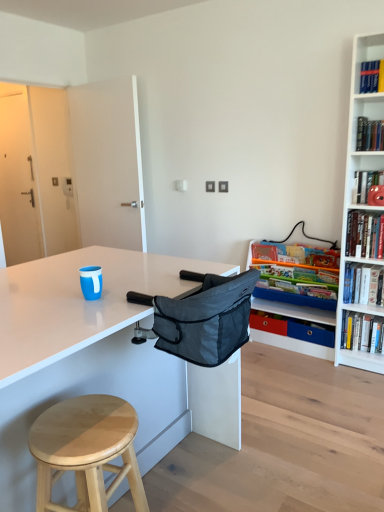
In order to face red plastic drawer at lower right, should I rotate leftwards or rightwards?

Turn right approximately 10.240 degrees to face it.

What do you see at coordinates (295, 311) in the screenshot?
I see `matte plastic shelf at right` at bounding box center [295, 311].

What do you see at coordinates (362, 332) in the screenshot? I see `hardcover book at upper right, marked as the fourth book in a top-to-bottom arrangement` at bounding box center [362, 332].

In order to face hardcover book at right, placed as the third book when sorted from bottom to top, should I rotate leftwards or rightwards?

Turn right by 13.514 degrees to look at hardcover book at right, placed as the third book when sorted from bottom to top.

Find the location of `light wood stool at lower left`. light wood stool at lower left is located at coordinates (86, 450).

Locate an element on the screen. The image size is (384, 512). red plastic drawer at lower right is located at coordinates (268, 322).

Considering the relative sizes of hardcover book at upper right, arranged as the fourth book when ordered from the bottom, and red plastic drawer at lower right in the image provided, is hardcover book at upper right, arranged as the fourth book when ordered from the bottom, taller than red plastic drawer at lower right?

Indeed, hardcover book at upper right, arranged as the fourth book when ordered from the bottom, has a greater height compared to red plastic drawer at lower right.

Looking at this image, who is bigger, hardcover book at upper right, the first book viewed from the top, or red plastic drawer at lower right?

With larger size is hardcover book at upper right, the first book viewed from the top.

Is hardcover book at upper right, arranged as the fourth book when ordered from the bottom, located outside red plastic drawer at lower right?

Yes, hardcover book at upper right, arranged as the fourth book when ordered from the bottom, is outside of red plastic drawer at lower right.

Which object is closer to the camera, hardcover book at upper right, the first book viewed from the top, or red plastic drawer at lower right?

hardcover book at upper right, the first book viewed from the top, is closer to the camera.

From a real-world perspective, is red plastic drawer at lower right positioned above or below dark gray fabric folding chair at center?

red plastic drawer at lower right is situated lower than dark gray fabric folding chair at center in the real world.

You are a GUI agent. You are given a task and a screenshot of the screen. Output one action in this format:
    pyautogui.click(x=<x>, y=<y>)
    Task: Click on the folding chair that appears above the red plastic drawer at lower right (from the image's perspective)
    This screenshot has width=384, height=512.
    Given the screenshot: What is the action you would take?
    pyautogui.click(x=203, y=317)

In the scene shown: Who is shorter, red plastic drawer at lower right or dark gray fabric folding chair at center?

With less height is red plastic drawer at lower right.

How different are the orientations of red plastic drawer at lower right and dark gray fabric folding chair at center in degrees?

The angle between the facing direction of red plastic drawer at lower right and the facing direction of dark gray fabric folding chair at center is 89.2 degrees.

Is red plastic drawer at lower right completely or partially inside hardcover book at upper right, the second book when ordered from bottom to top?

No, red plastic drawer at lower right is not surrounded by hardcover book at upper right, the second book when ordered from bottom to top.

Is hardcover book at upper right, the second book when ordered from bottom to top, taller than red plastic drawer at lower right?

Yes, hardcover book at upper right, the second book when ordered from bottom to top, is taller than red plastic drawer at lower right.

I want to click on book that is the 3rd object above the red plastic drawer at lower right (from a real-world perspective), so [x=363, y=284].

In terms of size, does hardcover book at upper right, the second book when ordered from bottom to top, appear bigger or smaller than red plastic drawer at lower right?

hardcover book at upper right, the second book when ordered from bottom to top, is bigger than red plastic drawer at lower right.

From the image's perspective, is dark gray fabric folding chair at center on light wood stool at lower left?

Indeed, from the image's perspective, dark gray fabric folding chair at center is shown above light wood stool at lower left.

The height and width of the screenshot is (512, 384). I want to click on folding chair above the light wood stool at lower left (from the image's perspective), so click(203, 317).

Which is more to the left, dark gray fabric folding chair at center or light wood stool at lower left?

light wood stool at lower left.

Which object is further away from the camera taking this photo, dark gray fabric folding chair at center or light wood stool at lower left?

dark gray fabric folding chair at center is further from the camera.

From a real-world perspective, is hardcover book at right, placed as the third book when sorted from bottom to top, positioned above or below hardcover book at upper right, marked as the fourth book in a top-to-bottom arrangement?

hardcover book at right, placed as the third book when sorted from bottom to top, is situated higher than hardcover book at upper right, marked as the fourth book in a top-to-bottom arrangement, in the real world.

Based on their sizes in the image, would you say hardcover book at right, acting as the 2th book starting from the top, is bigger or smaller than hardcover book at upper right, marked as the fourth book in a top-to-bottom arrangement?

Considering their sizes, hardcover book at right, acting as the 2th book starting from the top, takes up less space than hardcover book at upper right, marked as the fourth book in a top-to-bottom arrangement.

Does hardcover book at right, placed as the third book when sorted from bottom to top, touch hardcover book at upper right, positioned as the first book in bottom-to-top order?

No, hardcover book at right, placed as the third book when sorted from bottom to top, is not making contact with hardcover book at upper right, positioned as the first book in bottom-to-top order.

Considering the points (274, 276) and (357, 337), which point is behind, point (274, 276) or point (357, 337)?

The point (274, 276) is more distant.

This screenshot has height=512, width=384. Find the location of `book that is the 1st one when counting downward from the dark gray fabric folding chair at center (from the image's perspective)`. book that is the 1st one when counting downward from the dark gray fabric folding chair at center (from the image's perspective) is located at coordinates (363, 284).

In the scene shown: From the image's perspective, is dark gray fabric folding chair at center below hardcover book at upper right, the second book when ordered from bottom to top?

No, from the image's perspective, dark gray fabric folding chair at center is not below hardcover book at upper right, the second book when ordered from bottom to top.

Which of these two, dark gray fabric folding chair at center or hardcover book at upper right, the second book when ordered from bottom to top, stands taller?

Standing taller between the two is dark gray fabric folding chair at center.

How much distance is there between light wood stool at lower left and red plastic drawer at lower right?

light wood stool at lower left and red plastic drawer at lower right are 2.06 meters apart from each other.

Which object is positioned more to the left, light wood stool at lower left or red plastic drawer at lower right?

Positioned to the left is light wood stool at lower left.

Can you confirm if light wood stool at lower left is bigger than red plastic drawer at lower right?

Yes.

In terms of height, does light wood stool at lower left look taller or shorter compared to red plastic drawer at lower right?

Clearly, light wood stool at lower left is taller compared to red plastic drawer at lower right.

From a real-world perspective, count 4th books upward from the red plastic drawer at lower right and point to it. Please provide its 2D coordinates.

[(297, 255)]

Find the location of `drawer below the dark gray fabric folding chair at center (from the image's perspective)`. drawer below the dark gray fabric folding chair at center (from the image's perspective) is located at coordinates (268, 322).

When comparing their distances from matte plastic shelf at right, does light wood stool at lower left or red plastic drawer at lower right seem further?

light wood stool at lower left is further to matte plastic shelf at right.

From the picture: Based on their spatial positions, is light wood stool at lower left or hardcover book at right, acting as the 2th book starting from the top, further from dark gray fabric folding chair at center?

Based on the image, hardcover book at right, acting as the 2th book starting from the top, appears to be further to dark gray fabric folding chair at center.

Which object lies further to the anchor point light wood stool at lower left, matte plastic shelf at right or hardcover book at upper right, arranged as the fourth book when ordered from the bottom?

Based on the image, hardcover book at upper right, arranged as the fourth book when ordered from the bottom, appears to be further to light wood stool at lower left.

Looking at the image, which one is located closer to dark gray fabric folding chair at center, matte plastic shelf at right or light wood stool at lower left?

Among the two, light wood stool at lower left is located nearer to dark gray fabric folding chair at center.

Looking at the image, which one is located further to hardcover book at upper right, the second book when ordered from bottom to top, light wood stool at lower left or red plastic drawer at lower right?

The object further to hardcover book at upper right, the second book when ordered from bottom to top, is light wood stool at lower left.

From the image, which object appears to be nearer to hardcover book at upper right, the first book viewed from the top, dark gray fabric folding chair at center or red plastic drawer at lower right?

The object closer to hardcover book at upper right, the first book viewed from the top, is red plastic drawer at lower right.

When comparing their distances from light wood stool at lower left, does dark gray fabric folding chair at center or hardcover book at right, placed as the third book when sorted from bottom to top, seem closer?

dark gray fabric folding chair at center lies closer to light wood stool at lower left than the other object.

Based on their spatial positions, is matte plastic shelf at right or hardcover book at right, placed as the third book when sorted from bottom to top, further from hardcover book at upper right, which is the third book from top to bottom?

matte plastic shelf at right is positioned further to the anchor hardcover book at upper right, which is the third book from top to bottom.

This screenshot has height=512, width=384. I want to click on folding chair between light wood stool at lower left and hardcover book at upper right, marked as the fourth book in a top-to-bottom arrangement, from front to back, so point(203,317).

What are the coordinates of `shelf between light wood stool at lower left and hardcover book at upper right, arranged as the fourth book when ordered from the bottom, along the z-axis` in the screenshot? It's located at 295,311.

What are the coordinates of `shelf between hardcover book at upper right, arranged as the fourth book when ordered from the bottom, and red plastic drawer at lower right vertically` in the screenshot? It's located at (x=295, y=311).

You are a GUI agent. You are given a task and a screenshot of the screen. Output one action in this format:
    pyautogui.click(x=<x>, y=<y>)
    Task: Click on the shelf located between dark gray fabric folding chair at center and hardcover book at right, acting as the 2th book starting from the top, in the depth direction
    
    Given the screenshot: What is the action you would take?
    (295, 311)